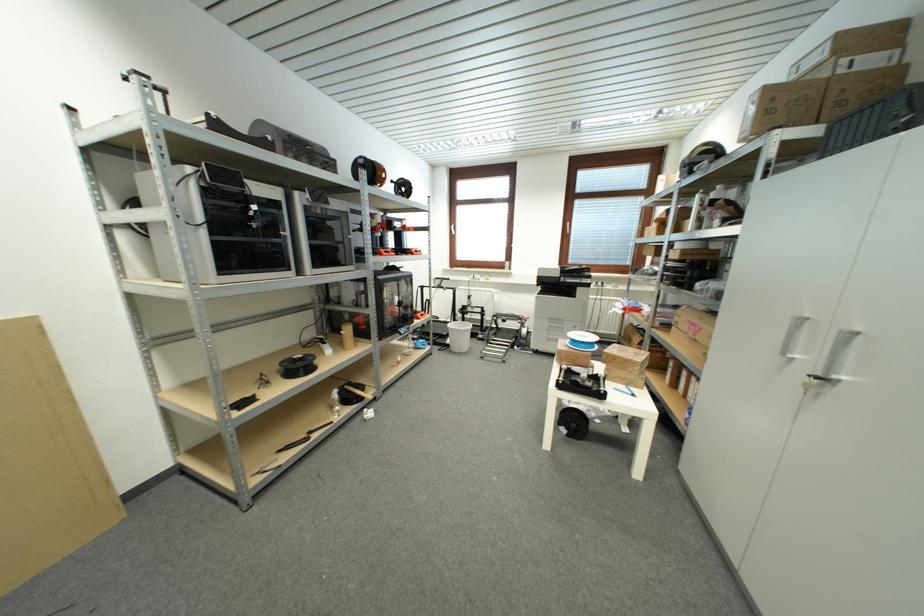
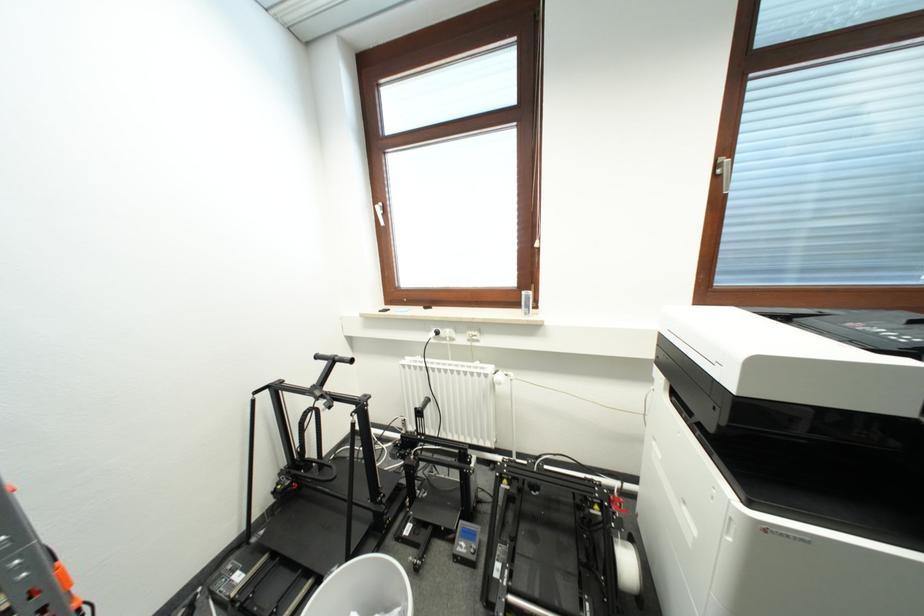
Find the pixel in the second image that matches [581,206] in the first image.

(766, 89)